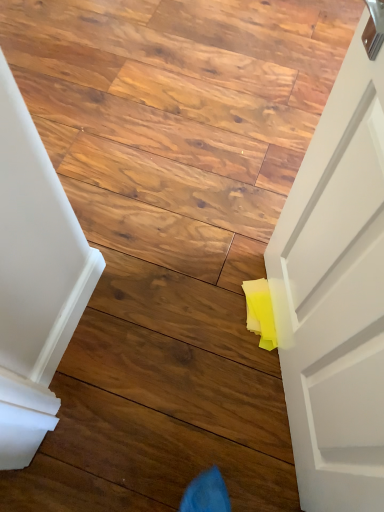
Describe the element at coordinates (178, 112) in the screenshot. This screenshot has height=512, width=384. I see `yellow paper at lower right` at that location.

The image size is (384, 512). In order to click on yellow paper at lower right in this screenshot , I will do `click(178, 112)`.

In order to face yellow paper at lower right, should I rotate leftwards or rightwards?

Turn left approximately 4.917 degrees to face it.

This screenshot has width=384, height=512. What do you see at coordinates (160, 450) in the screenshot?
I see `smooth wood plank at center` at bounding box center [160, 450].

The width and height of the screenshot is (384, 512). I want to click on smooth wood plank at center, so click(x=160, y=450).

Image resolution: width=384 pixels, height=512 pixels. I want to click on yellow paper at lower right, so click(x=178, y=112).

Which object is positioned more to the right, yellow paper at lower right or smooth wood plank at center?

smooth wood plank at center.

From the picture: Is yellow paper at lower right positioned in front of smooth wood plank at center?

No, yellow paper at lower right is behind smooth wood plank at center.

Considering the points (255, 136) and (94, 425), which point is in front, point (255, 136) or point (94, 425)?

The point (94, 425) is more forward.

From the image's perspective, would you say yellow paper at lower right is shown under smooth wood plank at center?

Actually, yellow paper at lower right appears above smooth wood plank at center in the image.

From a real-world perspective, does yellow paper at lower right sit lower than smooth wood plank at center?

Yes, from a real-world perspective, yellow paper at lower right is below smooth wood plank at center.

Is yellow paper at lower right thinner than smooth wood plank at center?

No, yellow paper at lower right is not thinner than smooth wood plank at center.

Considering the relative sizes of yellow paper at lower right and smooth wood plank at center in the image provided, is yellow paper at lower right taller than smooth wood plank at center?

No, yellow paper at lower right is not taller than smooth wood plank at center.

Can you confirm if yellow paper at lower right is bigger than smooth wood plank at center?

Indeed, yellow paper at lower right has a larger size compared to smooth wood plank at center.

Choose the correct answer: Is yellow paper at lower right inside smooth wood plank at center or outside it?

yellow paper at lower right is spatially situated outside smooth wood plank at center.

Is the surface of yellow paper at lower right in direct contact with smooth wood plank at center?

yellow paper at lower right and smooth wood plank at center are clearly separated.

Is yellow paper at lower right aimed at smooth wood plank at center?

No, yellow paper at lower right is not turned towards smooth wood plank at center.

How many degrees apart are the facing directions of yellow paper at lower right and smooth wood plank at center?

0.373 degrees separate the facing orientations of yellow paper at lower right and smooth wood plank at center.

How distant is yellow paper at lower right from smooth wood plank at center?

A distance of 34.72 inches exists between yellow paper at lower right and smooth wood plank at center.

You are a GUI agent. You are given a task and a screenshot of the screen. Output one action in this format:
    pyautogui.click(x=<x>, y=<y>)
    Task: Click on the stairwell on the left side of smooth wood plank at center
    The image size is (384, 512).
    Given the screenshot: What is the action you would take?
    pyautogui.click(x=178, y=112)

Considering the relative positions of smooth wood plank at center and yellow paper at lower right in the image provided, is smooth wood plank at center to the right of yellow paper at lower right from the viewer's perspective?

Correct, you'll find smooth wood plank at center to the right of yellow paper at lower right.

Looking at this image, is smooth wood plank at center positioned before yellow paper at lower right?

That is True.

Is point (152, 442) positioned before point (206, 88)?

Yes, point (152, 442) is closer to viewer.

From the image's perspective, which one is positioned lower, smooth wood plank at center or yellow paper at lower right?

From the image's view, smooth wood plank at center is below.

Based on the photo, from a real-world perspective, is smooth wood plank at center physically located above or below yellow paper at lower right?

From a real-world perspective, smooth wood plank at center is physically above yellow paper at lower right.

Does smooth wood plank at center have a lesser width compared to yellow paper at lower right?

Indeed, smooth wood plank at center has a lesser width compared to yellow paper at lower right.

Is smooth wood plank at center shorter than yellow paper at lower right?

No, smooth wood plank at center is not shorter than yellow paper at lower right.

Considering the sizes of objects smooth wood plank at center and yellow paper at lower right in the image provided, who is bigger, smooth wood plank at center or yellow paper at lower right?

With larger size is yellow paper at lower right.

Is smooth wood plank at center located outside yellow paper at lower right?

Yes.

Is there a large distance between smooth wood plank at center and yellow paper at lower right?

No, there isn't a large distance between smooth wood plank at center and yellow paper at lower right.

Could you tell me if smooth wood plank at center is facing yellow paper at lower right?

No, smooth wood plank at center is not turned towards yellow paper at lower right.

Measure the distance between smooth wood plank at center and yellow paper at lower right.

smooth wood plank at center and yellow paper at lower right are 88.20 centimeters apart.

Find the location of a particular element. This screenshot has height=512, width=384. stairwell to the left of smooth wood plank at center is located at coordinates (178, 112).

At what (x,y) coordinates should I click in order to perform the action: click on stairwell that appears below the smooth wood plank at center (from a real-world perspective). Please return your answer as a coordinate pair (x, y). The width and height of the screenshot is (384, 512). Looking at the image, I should click on (178, 112).

I want to click on plank that appears on the right of yellow paper at lower right, so click(x=160, y=450).